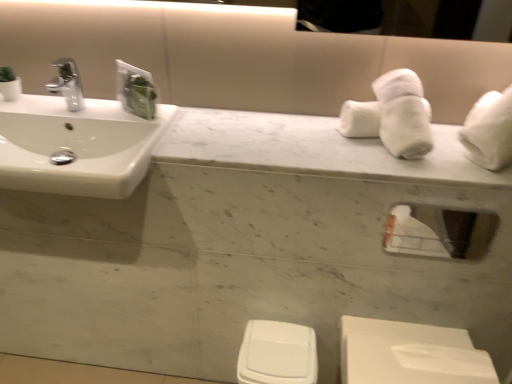
Question: Can you see clear glass mirror at upper right touching white plastic toilet bowl at lower center?

Choices:
 (A) no
 (B) yes

Answer: (A)

Question: Considering the relative sizes of clear glass mirror at upper right and white plastic toilet bowl at lower center in the image provided, is clear glass mirror at upper right smaller than white plastic toilet bowl at lower center?

Choices:
 (A) no
 (B) yes

Answer: (B)

Question: Is clear glass mirror at upper right behind white plastic toilet bowl at lower center?

Choices:
 (A) no
 (B) yes

Answer: (A)

Question: Is clear glass mirror at upper right not within white plastic toilet bowl at lower center?

Choices:
 (A) no
 (B) yes

Answer: (B)

Question: Does clear glass mirror at upper right appear on the left side of white plastic toilet bowl at lower center?

Choices:
 (A) no
 (B) yes

Answer: (A)

Question: From a real-world perspective, is clear glass mirror at upper right physically below white plastic toilet bowl at lower center?

Choices:
 (A) no
 (B) yes

Answer: (A)

Question: Is white marble counter top at center wider than white glossy sink at left?

Choices:
 (A) yes
 (B) no

Answer: (B)

Question: From a real-world perspective, is white marble counter top at center positioned under white glossy sink at left based on gravity?

Choices:
 (A) yes
 (B) no

Answer: (B)

Question: Is white marble counter top at center oriented towards white glossy sink at left?

Choices:
 (A) yes
 (B) no

Answer: (B)

Question: Is white marble counter top at center to the left of white glossy sink at left from the viewer's perspective?

Choices:
 (A) yes
 (B) no

Answer: (B)

Question: From the image's perspective, does white marble counter top at center appear lower than white glossy sink at left?

Choices:
 (A) no
 (B) yes

Answer: (A)

Question: Is white marble counter top at center shorter than white glossy sink at left?

Choices:
 (A) no
 (B) yes

Answer: (B)

Question: Considering the relative sizes of clear glass mirror at upper right and white glossy sink at left in the image provided, is clear glass mirror at upper right taller than white glossy sink at left?

Choices:
 (A) yes
 (B) no

Answer: (A)